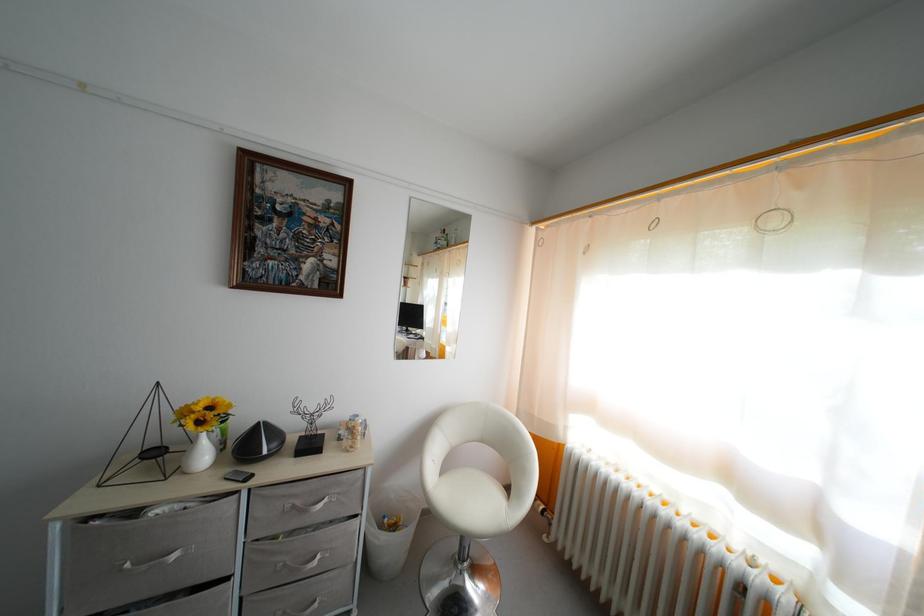
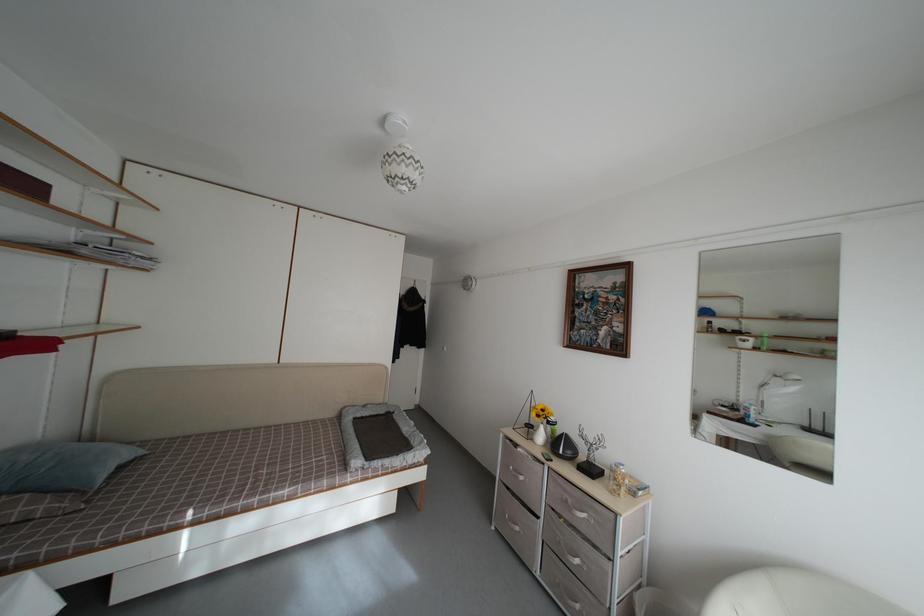
Question: Based on the continuous images, in which direction is the camera rotating? Reply with the corresponding letter.

Choices:
 (A) Left
 (B) Right
 (C) Up
 (D) Down

Answer: (A)